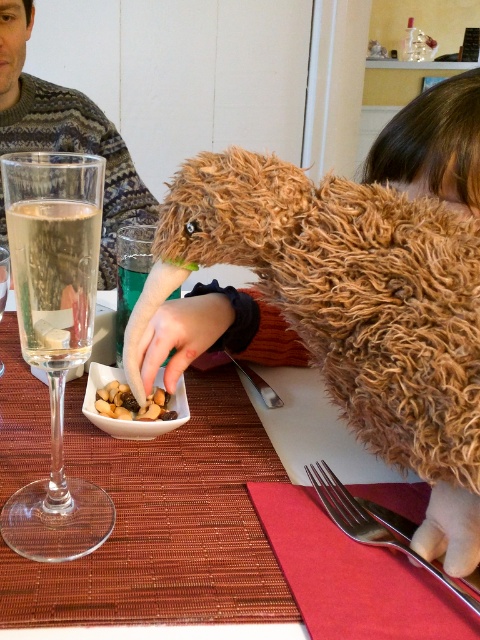
Does shiny metallic bowl of nuts at center have a greater width compared to transparent glass at left?

Yes.

Is shiny metallic bowl of nuts at center in front of transparent glass at left?

Yes, shiny metallic bowl of nuts at center is closer to the viewer.

You are a GUI agent. You are given a task and a screenshot of the screen. Output one action in this format:
    pyautogui.click(x=<x>, y=<y>)
    Task: Click on the shiny metallic bowl of nuts at center
    The image size is (480, 640).
    Given the screenshot: What is the action you would take?
    pyautogui.click(x=130, y=420)

Can you confirm if brown textured napkin at center is wider than silver metallic fork at lower center?

Correct, the width of brown textured napkin at center exceeds that of silver metallic fork at lower center.

Does point (216, 573) lie in front of point (351, 531)?

That is True.

What are the coordinates of `brown textured napkin at center` in the screenshot? It's located at (165, 524).

Is fuzzy brown stuffed animal at center below brown textured napkin at center?

No.

Is fuzzy brown stuffed animal at center smaller than brown textured napkin at center?

Indeed, fuzzy brown stuffed animal at center has a smaller size compared to brown textured napkin at center.

Does point (264, 205) come closer to viewer compared to point (120, 564)?

No.

The width and height of the screenshot is (480, 640). I want to click on fuzzy brown stuffed animal at center, so click(356, 308).